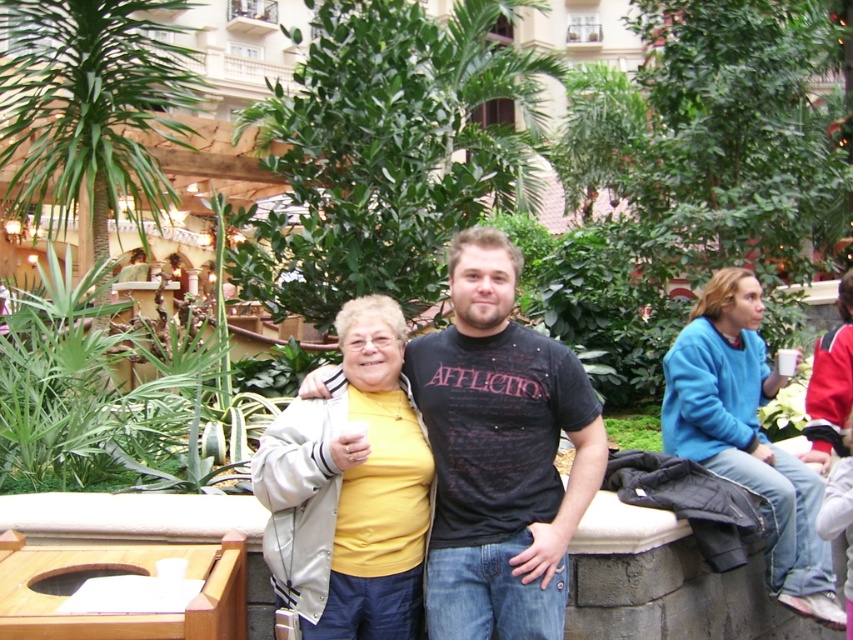
Between point (450, 445) and point (693, 428), which one is positioned in front?

Point (450, 445) is in front.

Is black matte t-shirt at center above blue fleece jacket at right?

Indeed, black matte t-shirt at center is positioned over blue fleece jacket at right.

Is point (537, 513) positioned in front of point (714, 371)?

Yes, point (537, 513) is in front of point (714, 371).

Where is `black matte t-shirt at center`? black matte t-shirt at center is located at coordinates (500, 452).

Does white fabric jacket at center appear on the right side of blue fleece jacket at right?

Incorrect, white fabric jacket at center is not on the right side of blue fleece jacket at right.

Who is positioned more to the right, white fabric jacket at center or blue fleece jacket at right?

Positioned to the right is blue fleece jacket at right.

I want to click on white fabric jacket at center, so click(350, 490).

Locate an element on the screen. black matte t-shirt at center is located at coordinates (500, 452).

Who is taller, black matte t-shirt at center or green leafy plant at center?

black matte t-shirt at center

Find the location of `black matte t-shirt at center`. black matte t-shirt at center is located at coordinates (500, 452).